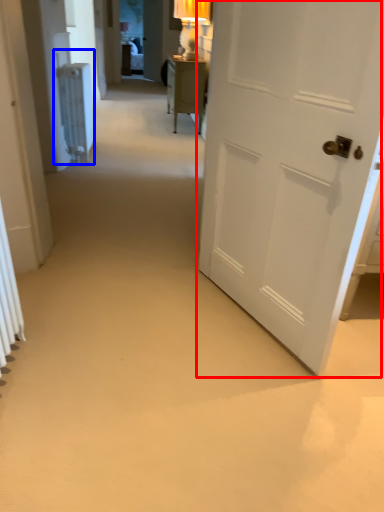
Question: Which object appears closest to the camera in this image, door (highlighted by a red box) or radiator (highlighted by a blue box)?

Choices:
 (A) door
 (B) radiator

Answer: (A)